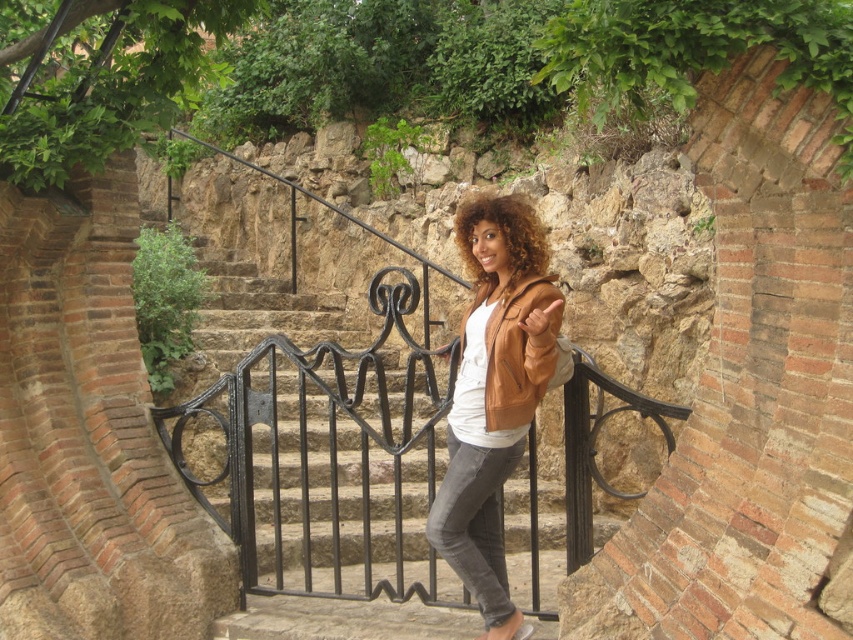
Does brown leather jacket at center appear on the left side of curly golden hair at center?

Indeed, brown leather jacket at center is positioned on the left side of curly golden hair at center.

Between brown leather jacket at center and curly golden hair at center, which one appears on the right side from the viewer's perspective?

From the viewer's perspective, curly golden hair at center appears more on the right side.

Who is more distant from viewer, (520, 326) or (485, 289)?

The point (485, 289) is more distant.

The width and height of the screenshot is (853, 640). I want to click on brown leather jacket at center, so click(x=494, y=394).